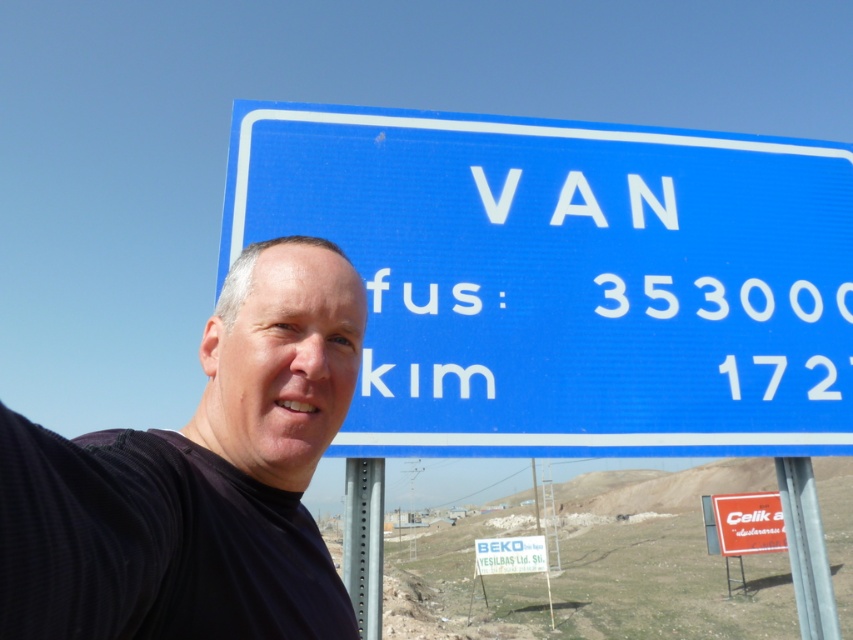
Does point (807, 557) lie behind point (776, 499)?

No.

Image resolution: width=853 pixels, height=640 pixels. Describe the element at coordinates (805, 548) in the screenshot. I see `metallic gray pole at right` at that location.

The width and height of the screenshot is (853, 640). I want to click on metallic gray pole at right, so click(805, 548).

Who is more forward, (367, 140) or (302, 321)?

Point (302, 321) is in front.

Can you confirm if blue plastic sign at upper center is bigger than black fabric at left?

Yes.

Between point (428, 147) and point (151, 534), which one is positioned behind?

The point (428, 147) is behind.

This screenshot has width=853, height=640. In order to click on blue plastic sign at upper center in this screenshot , I will do `click(567, 278)`.

Who is positioned more to the left, metallic gray pole at right or metallic pole at center?

metallic pole at center

Is metallic gray pole at right to the left of metallic pole at center from the viewer's perspective?

Incorrect, metallic gray pole at right is not on the left side of metallic pole at center.

Is point (816, 592) farther from camera compared to point (344, 488)?

No, it is in front of (344, 488).

In order to click on metallic gray pole at right in this screenshot , I will do coord(805,548).